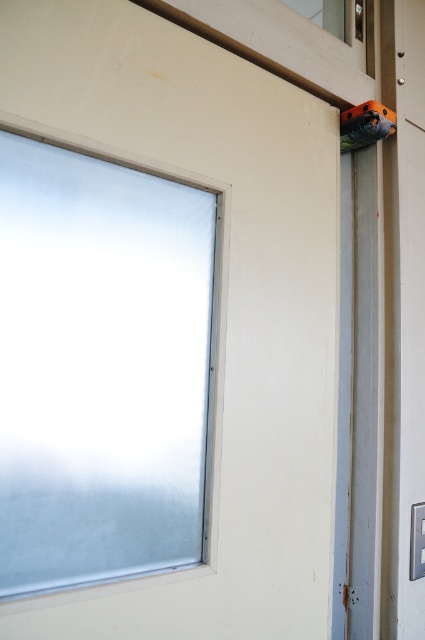
Question: Which point is farther from the camera taking this photo?

Choices:
 (A) (170, 397)
 (B) (382, 134)

Answer: (B)

Question: Among these points, which one is farthest from the camera?

Choices:
 (A) (51, 228)
 (B) (345, 132)

Answer: (B)

Question: Is frosted glass window at upper left to the left of orange plastic drill at upper right from the viewer's perspective?

Choices:
 (A) no
 (B) yes

Answer: (B)

Question: Does frosted glass window at upper left appear on the right side of orange plastic drill at upper right?

Choices:
 (A) no
 (B) yes

Answer: (A)

Question: Which point is farther to the camera?

Choices:
 (A) orange plastic drill at upper right
 (B) frosted glass window at upper left

Answer: (A)

Question: Can you confirm if frosted glass window at upper left is bigger than orange plastic drill at upper right?

Choices:
 (A) yes
 (B) no

Answer: (A)